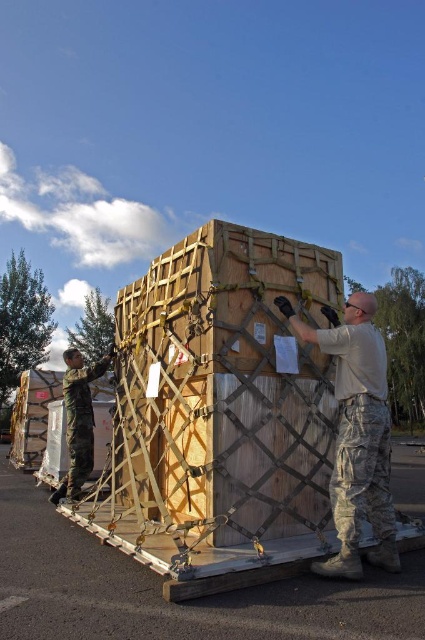
You are standing at the origin point in the image. The camouflage uniform at center is represented by point (357, 435). Which direction should you move to reach the camouflage uniform at center?

The camouflage uniform at center is located at point (357, 435), so you should move towards the center of the image to reach it.